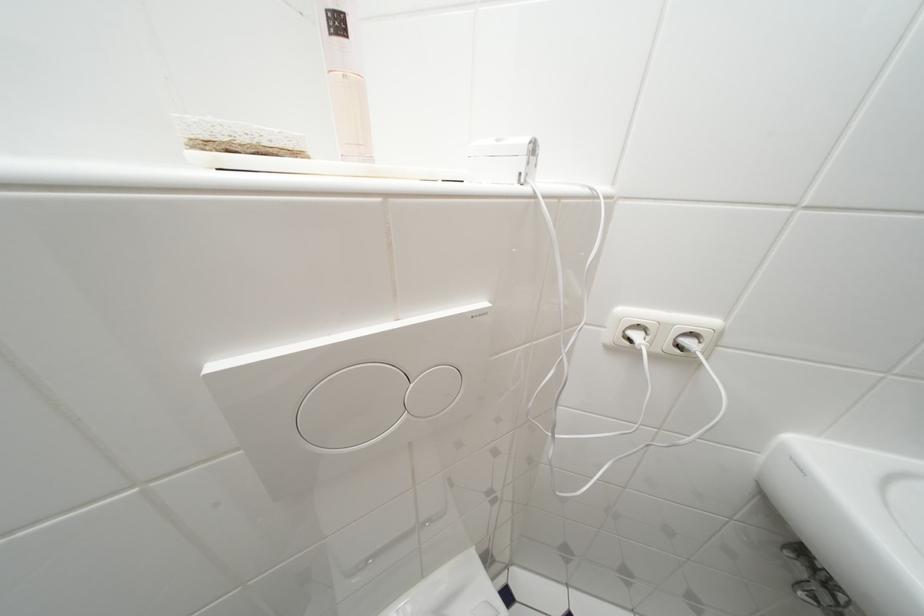
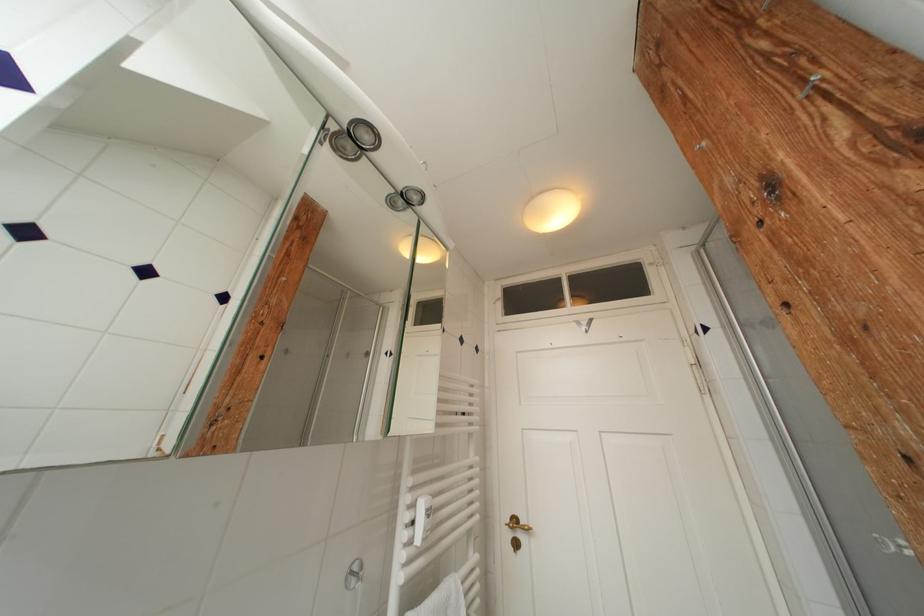
How did the camera likely rotate?

The camera rotated toward right-up.